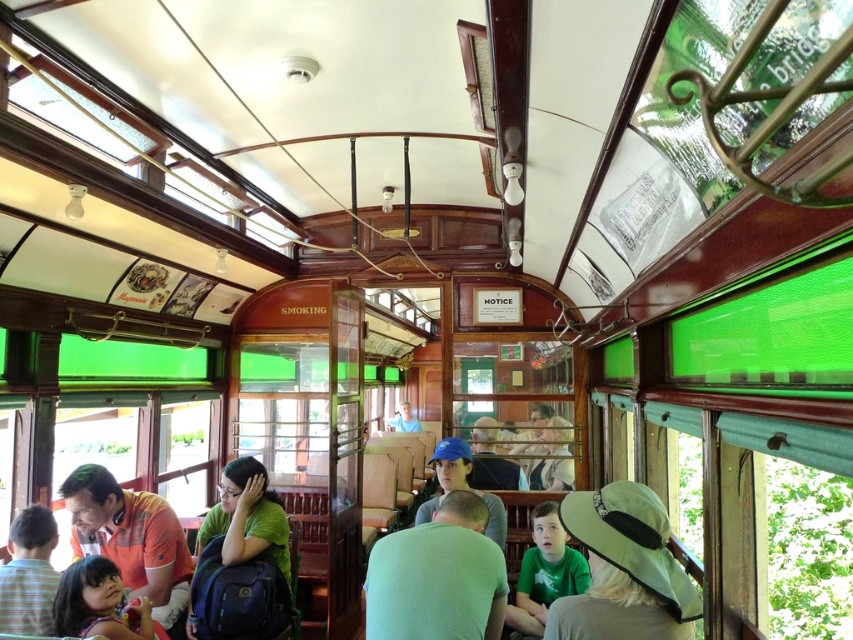
Question: Does green matte shirt at center have a larger size compared to blue fabric cap at center?

Choices:
 (A) yes
 (B) no

Answer: (B)

Question: Which of the following is the closest to the observer?

Choices:
 (A) matte orange shirt at lower left
 (B) green fabric backpack at center

Answer: (B)

Question: Estimate the real-world distances between objects in this image. Which object is farther from the green fabric hat at lower center?

Choices:
 (A) green fabric backpack at center
 (B) matte blue shirt at center

Answer: (B)

Question: Considering the relative positions of matte orange shirt at lower left and green fabric backpack at center in the image provided, where is matte orange shirt at lower left located with respect to green fabric backpack at center?

Choices:
 (A) above
 (B) below

Answer: (B)

Question: Which of the following is the farthest from the observer?

Choices:
 (A) green matte shirt at center
 (B) striped shirt at lower left

Answer: (B)

Question: Does green matte shirt at center come in front of matte pink shirt at lower left?

Choices:
 (A) yes
 (B) no

Answer: (A)